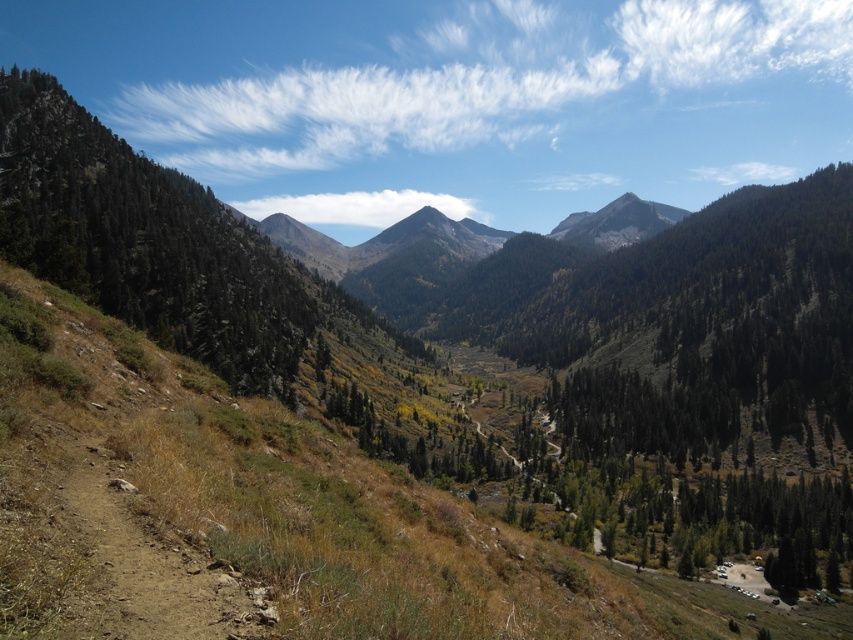
Does green leafy trees at left appear on the right side of smooth brown mountain at center?

Incorrect, green leafy trees at left is not on the right side of smooth brown mountain at center.

Does green leafy trees at left have a lesser height compared to smooth brown mountain at center?

Indeed, green leafy trees at left has a lesser height compared to smooth brown mountain at center.

Locate an element on the screen. This screenshot has width=853, height=640. green leafy trees at left is located at coordinates coord(143,241).

Where is `green leafy trees at left`? Image resolution: width=853 pixels, height=640 pixels. green leafy trees at left is located at coordinates (143, 241).